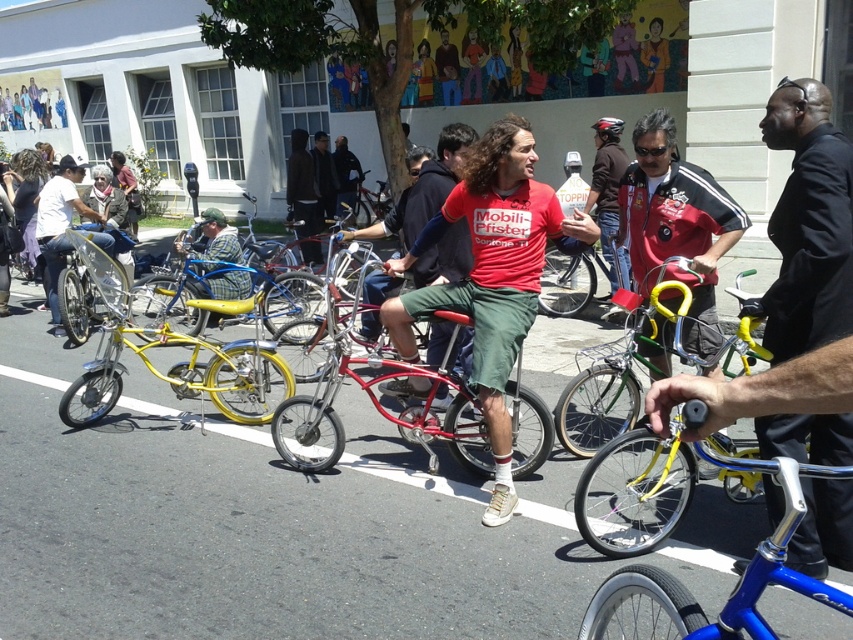
You are a photographer positioned at the front of the scene. You want to take a photo that includes both the shiny red bicycle at center and the matte yellow bicycle at left. Which bicycle should you move closer to the camera to ensure both are fully visible in the frame?

Since the shiny red bicycle at center is in front of the matte yellow bicycle at left, you should move the matte yellow bicycle at left closer to the camera to ensure both are fully visible in the frame.

You are a photographer trying to capture both the black suit jacket at center and the matte red shirt at center in a single frame. Since you want to ensure both are visible, which object should you focus on first to account for their sizes?

The black suit jacket at center is taller than the matte red shirt at center, so you should focus on the black suit jacket at center first to ensure its full height is captured before adjusting for the smaller matte red shirt at center.

Where is the yellow metallic bicycle at center located in the image?

The yellow metallic bicycle at center is located at point (611, 385).